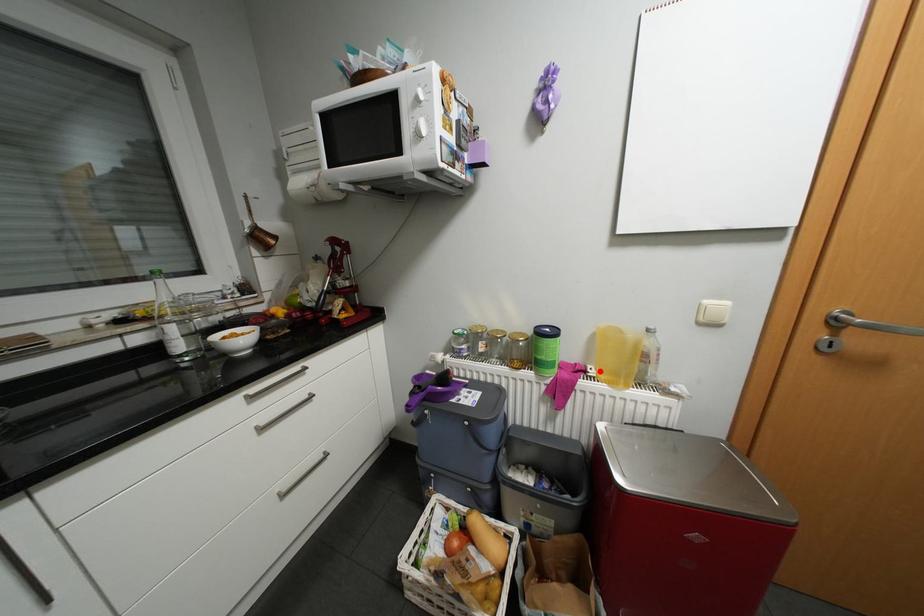
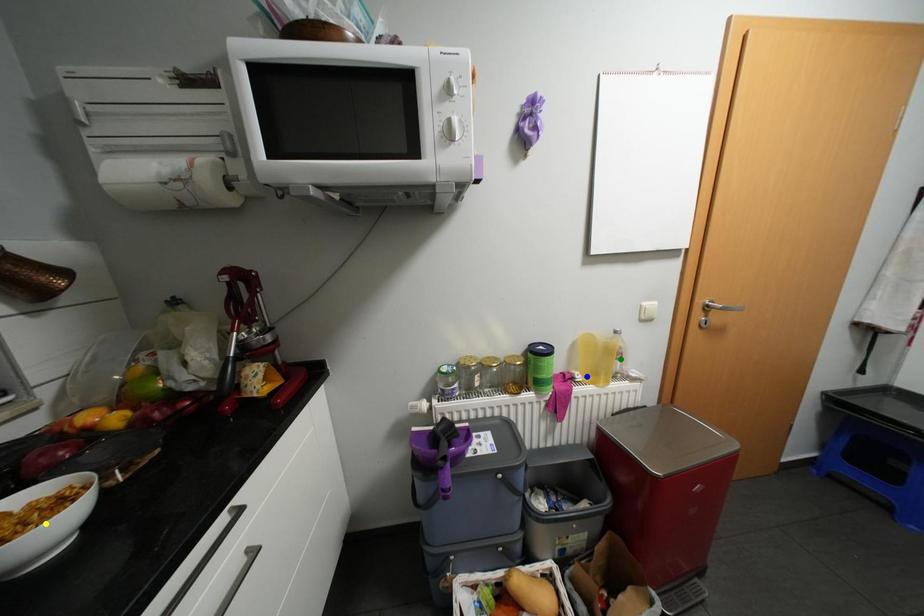
Question: I am providing you with two images of the same scene from different viewpoints. A red point is marked on the first image. You are given multiple points on the second image. Can you choose the point in image 2 that corresponds to the point in image 1?

Choices:
 (A) yellow point
 (B) green point
 (C) blue point

Answer: (C)